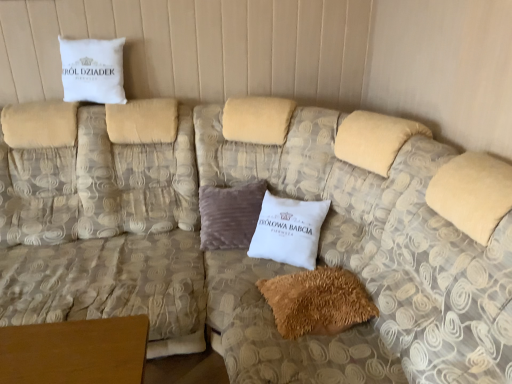
Where is `brown fuzzy pillow at lower center, which is the 1th pillow from front to back`? brown fuzzy pillow at lower center, which is the 1th pillow from front to back is located at coordinates (317, 301).

Measure the distance between brown fuzzy pillow at lower center, which is the 2th pillow from top to bottom, and camera.

They are 1.63 meters apart.

Locate an element on the screen. The width and height of the screenshot is (512, 384). beige fabric couch at upper left is located at coordinates (103, 220).

Locate an element on the screen. This screenshot has height=384, width=512. white cotton pillow at upper left, which is the second pillow in right-to-left order is located at coordinates (93, 70).

I want to click on brown fuzzy pillow at lower center, the second pillow when ordered from back to front, so click(x=317, y=301).

From the image's perspective, is beige fabric couch at upper left beneath brown fuzzy pillow at lower center, which is the 2th pillow from top to bottom?

Incorrect, from the image's perspective, beige fabric couch at upper left is higher than brown fuzzy pillow at lower center, which is the 2th pillow from top to bottom.

Based on the photo, how far apart are beige fabric couch at upper left and brown fuzzy pillow at lower center, acting as the second pillow starting from the left?

75.46 centimeters.

Between beige fabric couch at upper left and brown fuzzy pillow at lower center, positioned as the first pillow in right-to-left order, which one has larger size?

Bigger between the two is beige fabric couch at upper left.

Is brown fuzzy pillow at lower center, the second pillow when ordered from back to front, next to white cotton pillow at upper left, which appears as the first pillow when viewed from the left, and touching it?

brown fuzzy pillow at lower center, the second pillow when ordered from back to front, is not next to white cotton pillow at upper left, which appears as the first pillow when viewed from the left, and they're not touching.

Is brown fuzzy pillow at lower center, which is the 1th pillow from front to back, wider or thinner than white cotton pillow at upper left, which ranks as the second pillow in front-to-back order?

In the image, brown fuzzy pillow at lower center, which is the 1th pillow from front to back, appears to be wider than white cotton pillow at upper left, which ranks as the second pillow in front-to-back order.

Considering the sizes of brown fuzzy pillow at lower center, the second pillow when ordered from back to front, and white cotton pillow at upper left, the 1th pillow in the back-to-front sequence, in the image, is brown fuzzy pillow at lower center, the second pillow when ordered from back to front, taller or shorter than white cotton pillow at upper left, the 1th pillow in the back-to-front sequence,?

brown fuzzy pillow at lower center, the second pillow when ordered from back to front, is shorter than white cotton pillow at upper left, the 1th pillow in the back-to-front sequence.

From a real-world perspective, who is located higher, brown fuzzy pillow at lower center, positioned as the first pillow in right-to-left order, or white cotton pillow at upper left, which appears as the first pillow when viewed from the left?

white cotton pillow at upper left, which appears as the first pillow when viewed from the left, is physically above.

Which is closer to the camera, (98, 41) or (71, 194)?

Point (98, 41) is positioned farther from the camera compared to point (71, 194).

Who is smaller, white cotton pillow at upper left, which ranks as the second pillow in front-to-back order, or beige fabric couch at upper left?

Smaller between the two is white cotton pillow at upper left, which ranks as the second pillow in front-to-back order.

Is white cotton pillow at upper left, which appears as the first pillow when viewed from the left, beside beige fabric couch at upper left?

No, white cotton pillow at upper left, which appears as the first pillow when viewed from the left, is not with beige fabric couch at upper left.

Who is taller, white cotton pillow at upper left, which is the second pillow in right-to-left order, or beige fabric couch at upper left?

beige fabric couch at upper left is taller.

Considering the points (79, 109) and (116, 87), which point is in front, point (79, 109) or point (116, 87)?

The point (79, 109) is closer.

Considering the sizes of beige fabric couch at upper left and white cotton pillow at upper left, the 1th pillow in the back-to-front sequence, in the image, is beige fabric couch at upper left bigger or smaller than white cotton pillow at upper left, the 1th pillow in the back-to-front sequence,?

Answer: beige fabric couch at upper left is bigger than white cotton pillow at upper left, the 1th pillow in the back-to-front sequence.

From a real-world perspective, who is located lower, beige fabric couch at upper left or white cotton pillow at upper left, the 1th pillow in the back-to-front sequence?

In real-world perspective, beige fabric couch at upper left is lower.

In the image, is beige fabric couch at upper left positioned in front of or behind white cotton pillow at upper left, which is the second pillow in right-to-left order?

Clearly, beige fabric couch at upper left is in front of white cotton pillow at upper left, which is the second pillow in right-to-left order.

This screenshot has height=384, width=512. I want to click on pillow above the brown fuzzy pillow at lower center, which ranks as the 1th pillow in bottom-to-top order (from the image's perspective), so click(x=93, y=70).

Between white cotton pillow at upper left, the 1th pillow in the back-to-front sequence, and brown fuzzy pillow at lower center, which ranks as the 1th pillow in bottom-to-top order, which one has smaller width?

With smaller width is white cotton pillow at upper left, the 1th pillow in the back-to-front sequence.

Is the depth of white cotton pillow at upper left, positioned as the second pillow in bottom-to-top order, less than that of brown fuzzy pillow at lower center, which is the 1th pillow from front to back?

That is False.

Is white cotton pillow at upper left, which is the second pillow in right-to-left order, to the right of brown fuzzy pillow at lower center, positioned as the first pillow in right-to-left order, from the viewer's perspective?

No, white cotton pillow at upper left, which is the second pillow in right-to-left order, is not to the right of brown fuzzy pillow at lower center, positioned as the first pillow in right-to-left order.

From a real-world perspective, who is located higher, brown fuzzy pillow at lower center, which is the 2th pillow from top to bottom, or beige fabric couch at upper left?

beige fabric couch at upper left, from a real-world perspective.

Choose the correct answer: Is brown fuzzy pillow at lower center, which ranks as the 1th pillow in bottom-to-top order, inside beige fabric couch at upper left or outside it?

brown fuzzy pillow at lower center, which ranks as the 1th pillow in bottom-to-top order, is outside beige fabric couch at upper left.

What are the coordinates of `couch above the brown fuzzy pillow at lower center, positioned as the first pillow in right-to-left order (from the image's perspective)` in the screenshot? It's located at (103, 220).

Looking at this image, between brown fuzzy pillow at lower center, the second pillow when ordered from back to front, and beige fabric couch at upper left, which one has larger width?

Wider between the two is beige fabric couch at upper left.

This screenshot has height=384, width=512. Identify the location of pillow that is under the beige fabric couch at upper left (from a real-world perspective). (317, 301).

In order to click on pillow that is below the white cotton pillow at upper left, positioned as the second pillow in bottom-to-top order (from the image's perspective) in this screenshot , I will do `click(317, 301)`.

When comparing their distances from beige fabric couch at upper left, does white cotton pillow at upper left, which is the second pillow in right-to-left order, or brown fuzzy pillow at lower center, which is the 2th pillow from top to bottom, seem closer?

white cotton pillow at upper left, which is the second pillow in right-to-left order, is closer to beige fabric couch at upper left.

Considering their positions, is white cotton pillow at upper left, the 1th pillow in the back-to-front sequence, positioned closer to brown fuzzy pillow at lower center, acting as the second pillow starting from the left, than beige fabric couch at upper left?

beige fabric couch at upper left.

Which object lies nearer to the anchor point white cotton pillow at upper left, which ranks as the second pillow in front-to-back order, beige fabric couch at upper left or brown fuzzy pillow at lower center, which is the 1th pillow from front to back?

beige fabric couch at upper left lies closer to white cotton pillow at upper left, which ranks as the second pillow in front-to-back order, than the other object.

When comparing their distances from beige fabric couch at upper left, does brown fuzzy pillow at lower center, the second pillow when ordered from back to front, or white cotton pillow at upper left, which appears as the first pillow when viewed from the left, seem further?

Based on the image, brown fuzzy pillow at lower center, the second pillow when ordered from back to front, appears to be further to beige fabric couch at upper left.

Considering their positions, is brown fuzzy pillow at lower center, which is the 1th pillow from front to back, positioned closer to white cotton pillow at upper left, which is the second pillow in right-to-left order, than beige fabric couch at upper left?

beige fabric couch at upper left is positioned closer to the anchor white cotton pillow at upper left, which is the second pillow in right-to-left order.

Looking at this image, based on their spatial positions, is beige fabric couch at upper left or white cotton pillow at upper left, the 1th pillow in the back-to-front sequence, closer to brown fuzzy pillow at lower center, which is the 2th pillow from top to bottom?

beige fabric couch at upper left is closer to brown fuzzy pillow at lower center, which is the 2th pillow from top to bottom.

What are the coordinates of `pillow situated between beige fabric couch at upper left and brown fuzzy pillow at lower center, positioned as the first pillow in right-to-left order, from left to right` in the screenshot? It's located at (93, 70).